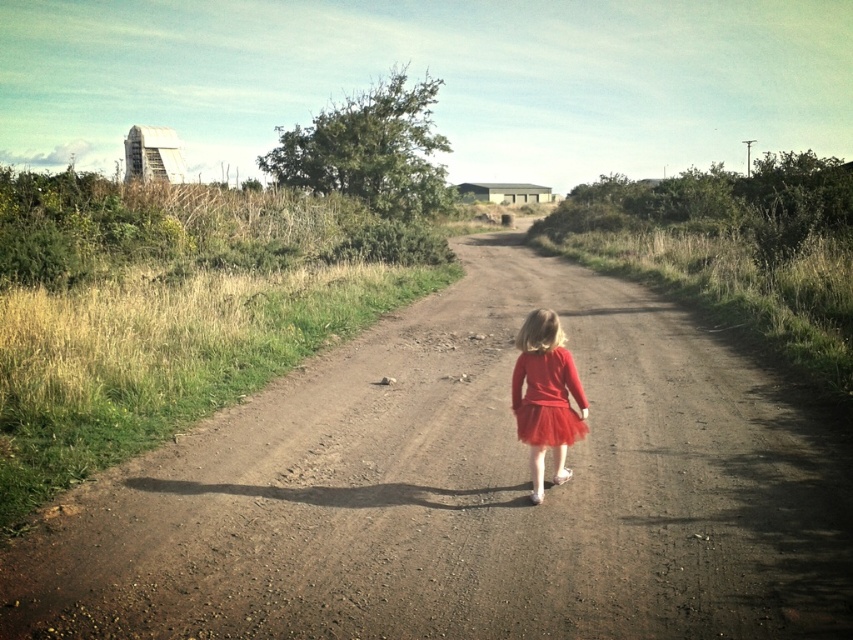
Question: Which object appears farthest from the camera in this image?

Choices:
 (A) red tulle skirt at center
 (B) brown dirt track at center

Answer: (A)

Question: Can you confirm if brown dirt track at center is positioned below red tulle skirt at center?

Choices:
 (A) yes
 (B) no

Answer: (A)

Question: Considering the relative positions of brown dirt track at center and red tulle skirt at center in the image provided, where is brown dirt track at center located with respect to red tulle skirt at center?

Choices:
 (A) below
 (B) above

Answer: (A)

Question: Can you confirm if brown dirt track at center is wider than red tulle skirt at center?

Choices:
 (A) no
 (B) yes

Answer: (B)